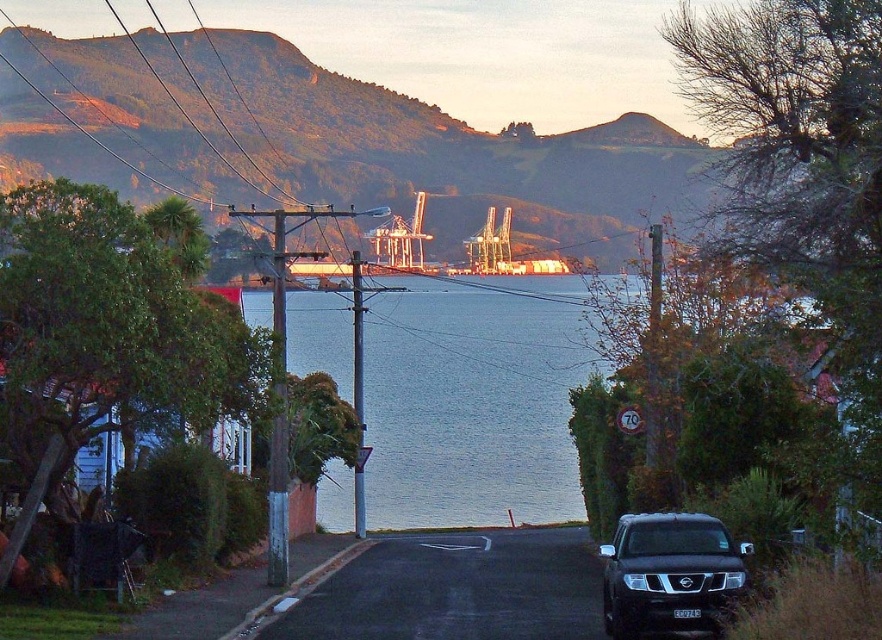
Question: Among these points, which one is nearest to the camera?

Choices:
 (A) (714, 576)
 (B) (385, 508)

Answer: (A)

Question: In this image, where is blue water at center located relative to satin black suv at lower right?

Choices:
 (A) left
 (B) right

Answer: (A)

Question: Is green textured mountain at upper center bigger than satin black suv at lower right?

Choices:
 (A) yes
 (B) no

Answer: (A)

Question: Which of the following is the closest to the observer?

Choices:
 (A) click(x=221, y=33)
 (B) click(x=679, y=573)

Answer: (B)

Question: Is green textured mountain at upper center smaller than blue water at center?

Choices:
 (A) no
 (B) yes

Answer: (A)

Question: Estimate the real-world distances between objects in this image. Which object is closer to the green textured mountain at upper center?

Choices:
 (A) blue water at center
 (B) satin black suv at lower right

Answer: (A)